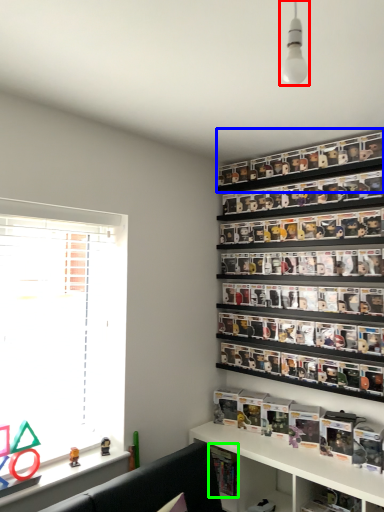
Question: Considering the real-world distances, which object is farthest from light fixture (highlighted by a red box)? shelf (highlighted by a blue box) or book (highlighted by a green box)?

Choices:
 (A) shelf
 (B) book

Answer: (B)